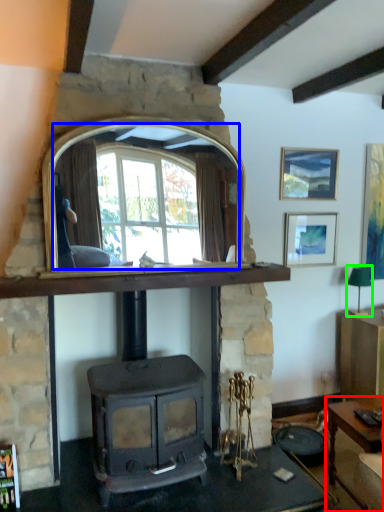
Question: Estimate the real-world distances between objects in this image. Which object is closer to desk (highlighted by a red box), mirror (highlighted by a blue box) or lamp (highlighted by a green box)?

Choices:
 (A) mirror
 (B) lamp

Answer: (B)